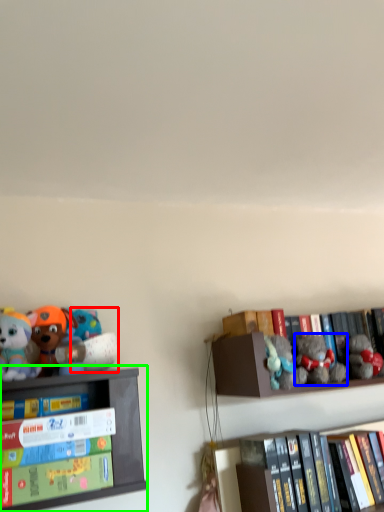
Question: Based on their relative distances, which object is farther from toy (highlighted by a red box)? Choose from toy (highlighted by a blue box) and shelf (highlighted by a green box).

Choices:
 (A) toy
 (B) shelf

Answer: (A)